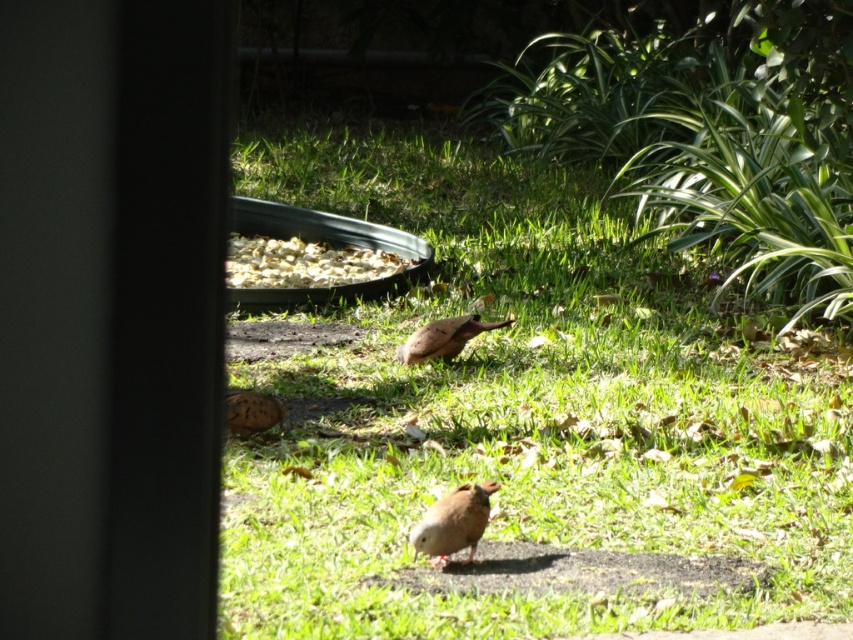
Question: Can you confirm if green grass at center is positioned to the left of white crumbly food at center?

Choices:
 (A) yes
 (B) no

Answer: (B)

Question: Which object appears farthest from the camera in this image?

Choices:
 (A) brown matte bird at center
 (B) white crumbly food at center

Answer: (B)

Question: Does green grass at center have a larger size compared to brown matte bird at center?

Choices:
 (A) no
 (B) yes

Answer: (A)

Question: Which object is positioned closest to the white crumbly food at center?

Choices:
 (A) brown matte bird at center
 (B) brown speckled bird at center

Answer: (A)

Question: Can you confirm if green grass at center is positioned to the right of brown speckled bird at center?

Choices:
 (A) no
 (B) yes

Answer: (B)

Question: Estimate the real-world distances between objects in this image. Which object is closer to the green grass at center?

Choices:
 (A) brown matte bird at center
 (B) brown speckled bird at center
 (C) white crumbly food at center

Answer: (B)